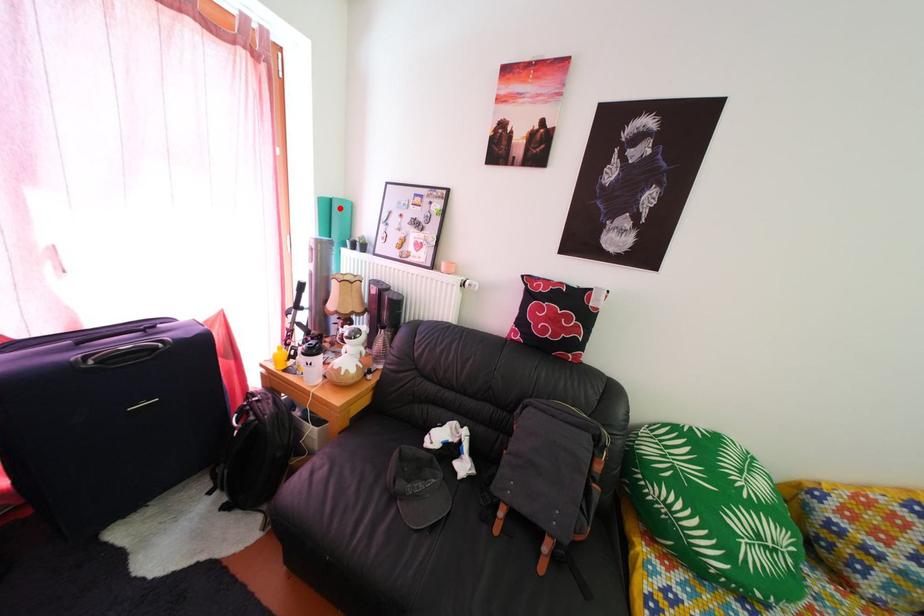
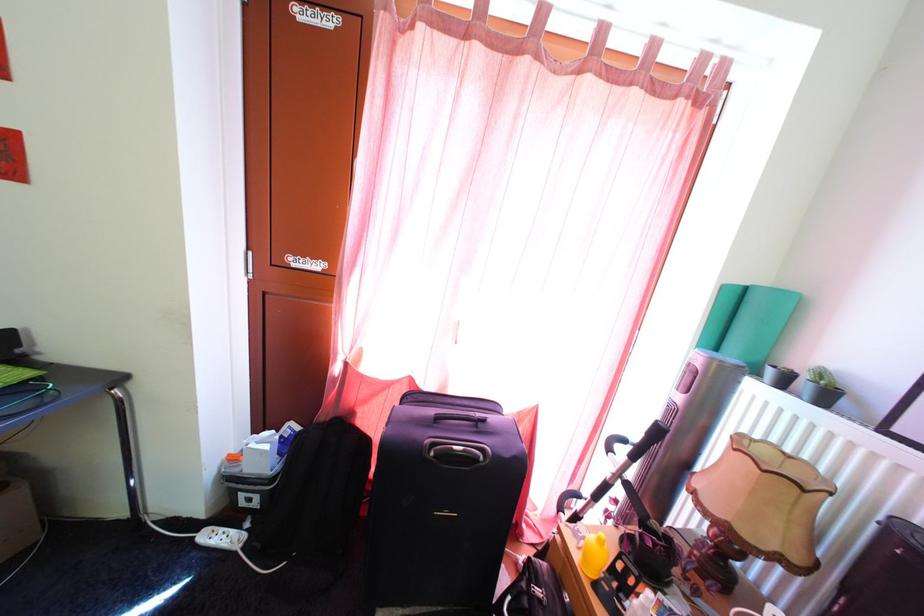
Question: I am providing you with two images of the same scene from different viewpoints. In image1, a red point is highlighted. Considering the same 3D point in image2, which of the following is correct?

Choices:
 (A) It is closer
 (B) It is farther

Answer: (B)